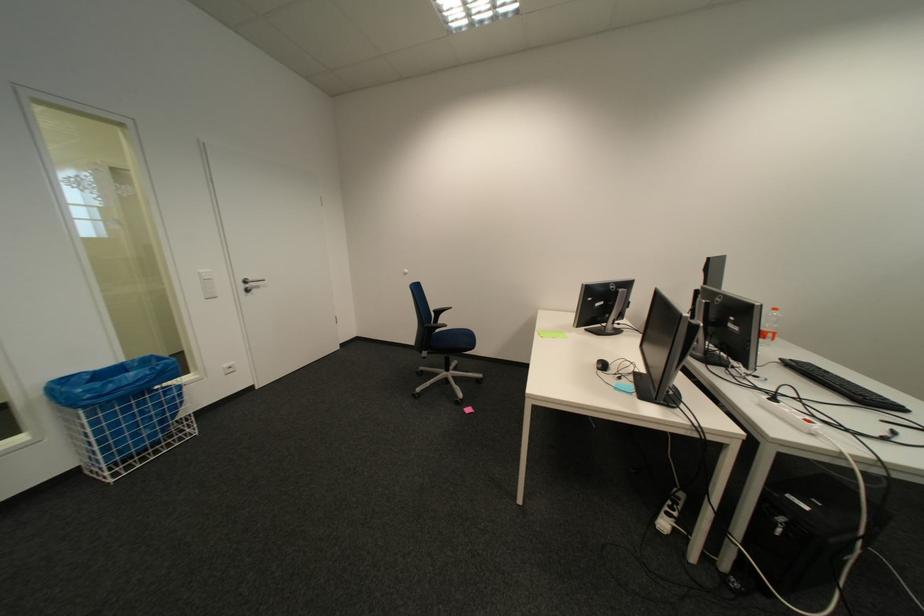
Which object does [602,365] point to?

This point indicates the black computer mouse.